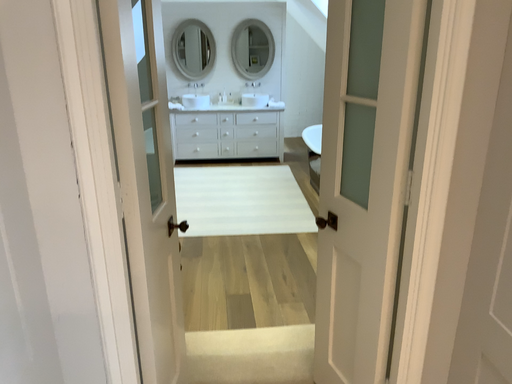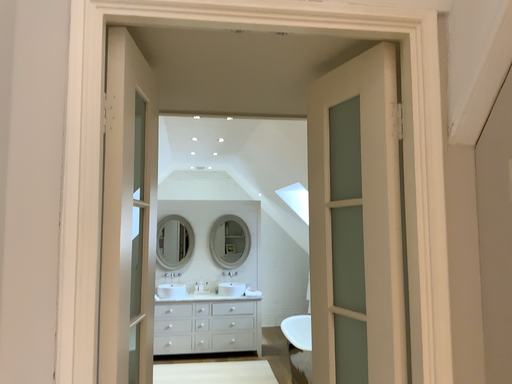
Question: How did the camera likely rotate when shooting the video?

Choices:
 (A) rotated upward
 (B) rotated downward

Answer: (A)